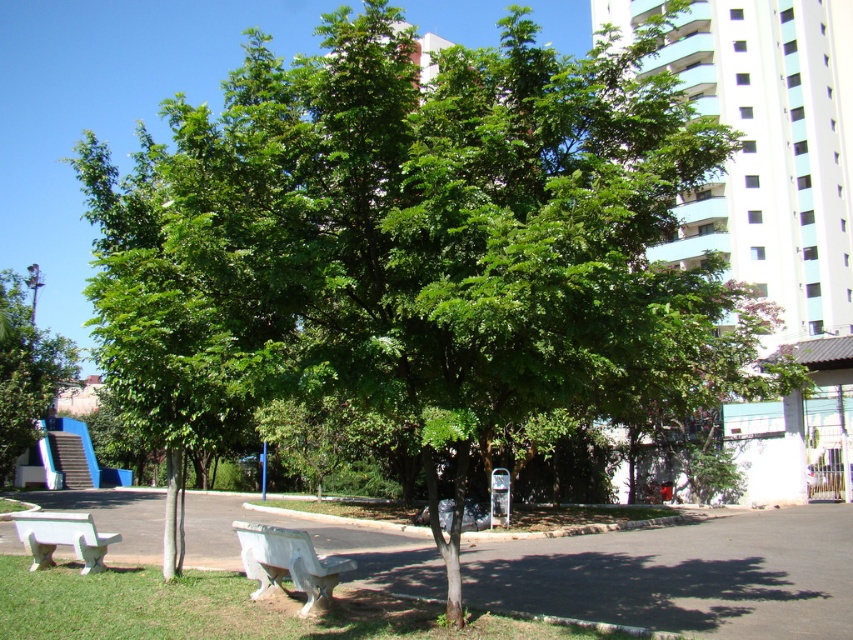
You are a park visitor wanting to sit on the benches. If you walk towards the white concrete bench at lower center and the white plastic bench at lower left from the entrance, which bench will you encounter first?

The white concrete bench at lower center is in front of the white plastic bench at lower left, so you will encounter the white concrete bench at lower center first.

You are standing in the park and want to take a photo of the green leafy tree at left. If your camera can focus on objects up to 70 feet away, will you need to move closer to take a clear picture?

The green leafy tree at left is 71.67 feet away from viewer, which is beyond the camera focus range of 70 feet. You need to move closer to ensure the tree is within the camera focus range.

You are standing at the entrance of the park and see the white concrete bench at lower center. If you want to reach the bench as quickly as possible, in which direction should you walk from your current position?

The white concrete bench at lower center is located at point (288, 563), so you should walk towards the lower center direction to reach it quickly.